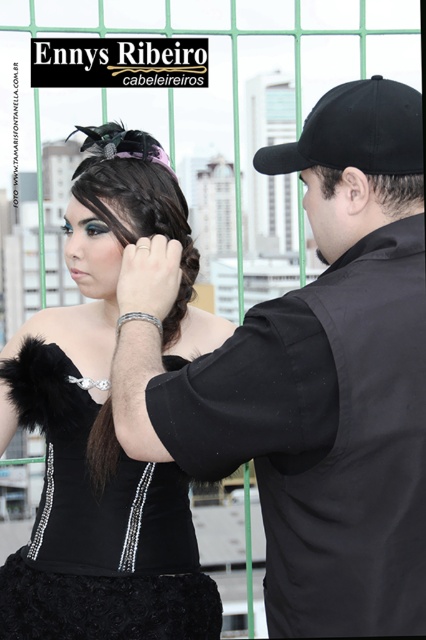
You are standing at the point with coordinates point (189, 284) and want to walk to the point with coordinates point (259, 483). Based on the scene description, is the destination point in front of or behind your current position?

The point (259, 483) is in front of point (189, 284), so the destination point is in front of your current position.

You are a photographer on a rooftop in the city. You notice the black matte vest at center and the satin dark brown hair at center. Which object is closer to you based on their positions?

The black matte vest at center is closer to you because it is in front of the satin dark brown hair at center.